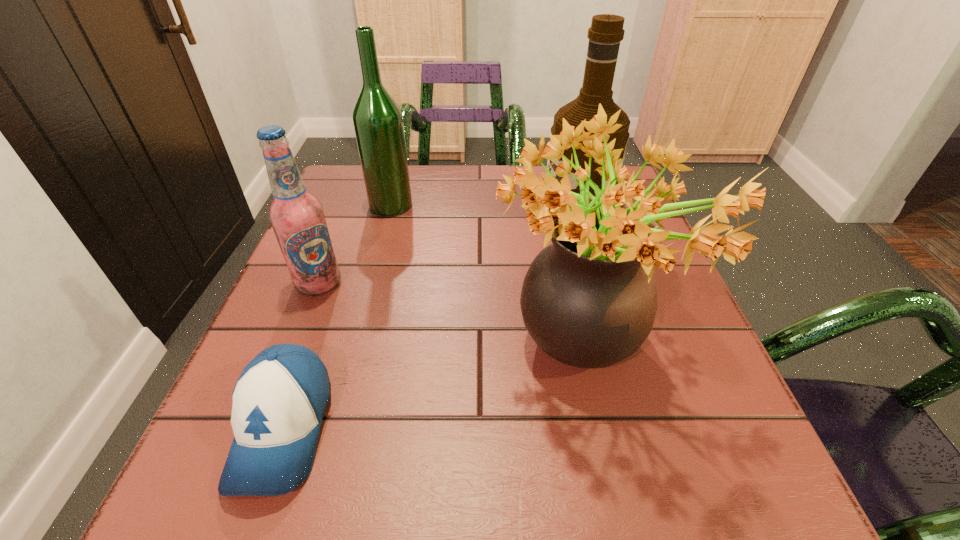
The image size is (960, 540). What are the coordinates of `vacant space situated on the left of the flower arrangement` in the screenshot? It's located at (431, 355).

At what (x,y) coordinates should I click in order to perform the action: click on blank space located 0.370m on the front of the nearest alcohol. Please return your answer as a coordinate pair (x, y). The width and height of the screenshot is (960, 540). Looking at the image, I should click on (228, 509).

Identify the location of object located at the near edge. (279, 400).

You are a GUI agent. You are given a task and a screenshot of the screen. Output one action in this format:
    pyautogui.click(x=<x>, y=<y>)
    Task: Click on the baseball cap that is positioned at the left edge
    The height and width of the screenshot is (540, 960).
    Given the screenshot: What is the action you would take?
    pyautogui.click(x=279, y=400)

Find the location of a particular element. The image size is (960, 540). alcohol present at the right edge is located at coordinates (606, 32).

You are a GUI agent. You are given a task and a screenshot of the screen. Output one action in this format:
    pyautogui.click(x=<x>, y=<y>)
    Task: Click on the flower arrangement located at the right edge
    The image size is (960, 540).
    Given the screenshot: What is the action you would take?
    pyautogui.click(x=589, y=300)

This screenshot has width=960, height=540. Identify the location of object that is at the far left corner. (377, 119).

The image size is (960, 540). I want to click on object that is positioned at the near left corner, so click(279, 400).

Locate an element on the screen. The height and width of the screenshot is (540, 960). object present at the far right corner is located at coordinates (606, 32).

Image resolution: width=960 pixels, height=540 pixels. In the image, there is a desktop. Find the location of `vacant space at the far edge`. vacant space at the far edge is located at coordinates (421, 168).